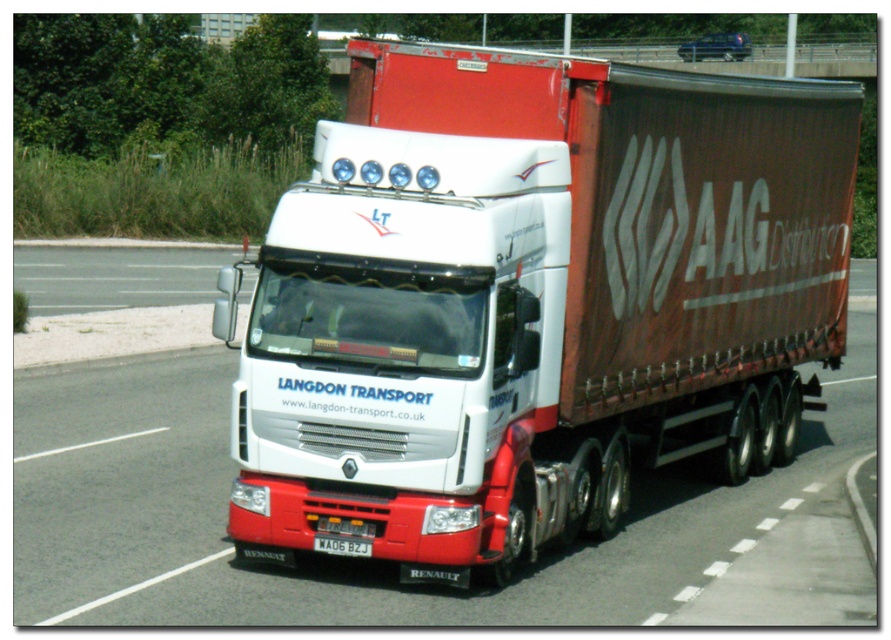
You are a driver who just got into the white matte truck at center. You need to check the license plate number on the red plastic license plate at bottom center. To do this, which direction should you turn your head?

Since the white matte truck at center is to the right of the red plastic license plate at bottom center, you should turn your head to the right to see the license plate.

What are the coordinates of the white matte truck at center in the image?

The white matte truck at center is located at coordinates point (532, 300).